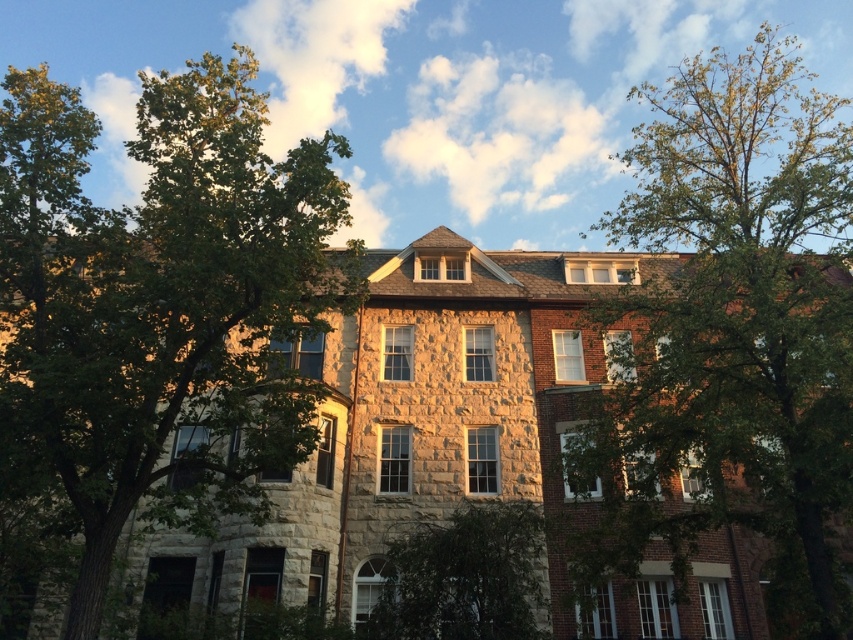
Who is more forward, (280, 189) or (393, 588)?

Point (280, 189) is in front.

Does green leafy tree at left have a greater height compared to green leafy tree at center?

Yes.

Does point (10, 300) lie in front of point (469, 524)?

Yes, point (10, 300) is closer to viewer.

Locate an element on the screen. Image resolution: width=853 pixels, height=640 pixels. green leafy tree at left is located at coordinates [164, 301].

Between green leafy tree at right and green leafy tree at center, which one is positioned higher?

green leafy tree at right is above.

Is point (717, 160) positioned in front of point (392, 605)?

No, (717, 160) is behind (392, 605).

Locate an element on the screen. The image size is (853, 640). green leafy tree at right is located at coordinates (730, 323).

Consider the image. Does green leafy tree at left have a greater height compared to green leafy tree at right?

No, green leafy tree at left is not taller than green leafy tree at right.

Consider the image. Is green leafy tree at left further to camera compared to green leafy tree at right?

No.

Is point (1, 268) farther from camera compared to point (700, 298)?

That is False.

Locate an element on the screen. The height and width of the screenshot is (640, 853). green leafy tree at left is located at coordinates (164, 301).